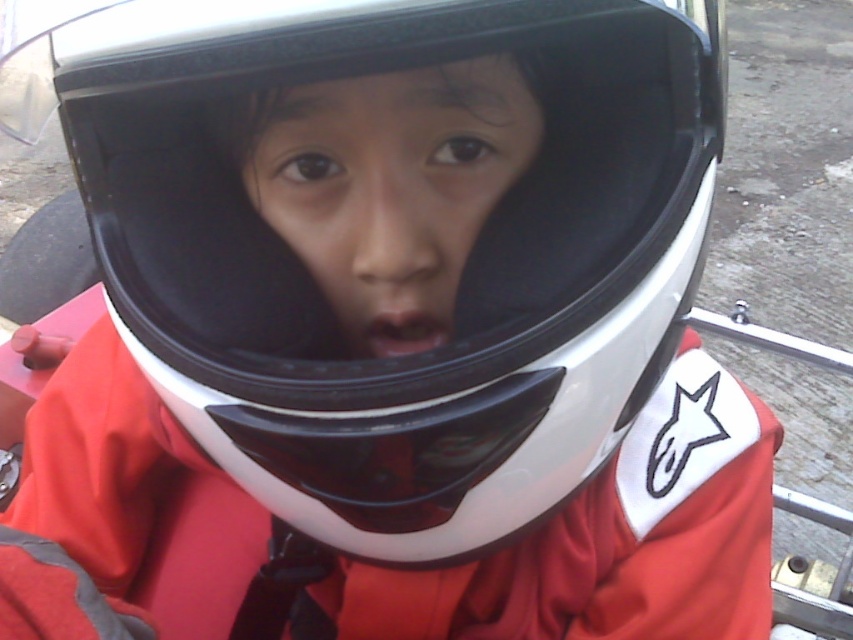
Question: Is matte skin nose at center above matte black mouth at center?

Choices:
 (A) yes
 (B) no

Answer: (A)

Question: Which of the following is the farthest from the observer?

Choices:
 (A) (421, 4)
 (B) (389, 326)
 (C) (407, 74)

Answer: (B)

Question: Can you confirm if matte black helmet at center is positioned to the left of matte skin nose at center?

Choices:
 (A) no
 (B) yes

Answer: (B)

Question: Estimate the real-world distances between objects in this image. Which object is farther from the matte black helmet at center?

Choices:
 (A) matte skin nose at center
 (B) matte black mouth at center
 (C) transparent matte plastic goggles at center

Answer: (C)

Question: From the image, what is the correct spatial relationship of matte black helmet at center in relation to matte black mouth at center?

Choices:
 (A) right
 (B) left

Answer: (B)

Question: Which object is positioned closest to the transparent matte plastic goggles at center?

Choices:
 (A) white matte helmet at center
 (B) matte black mouth at center
 (C) matte black helmet at center

Answer: (B)